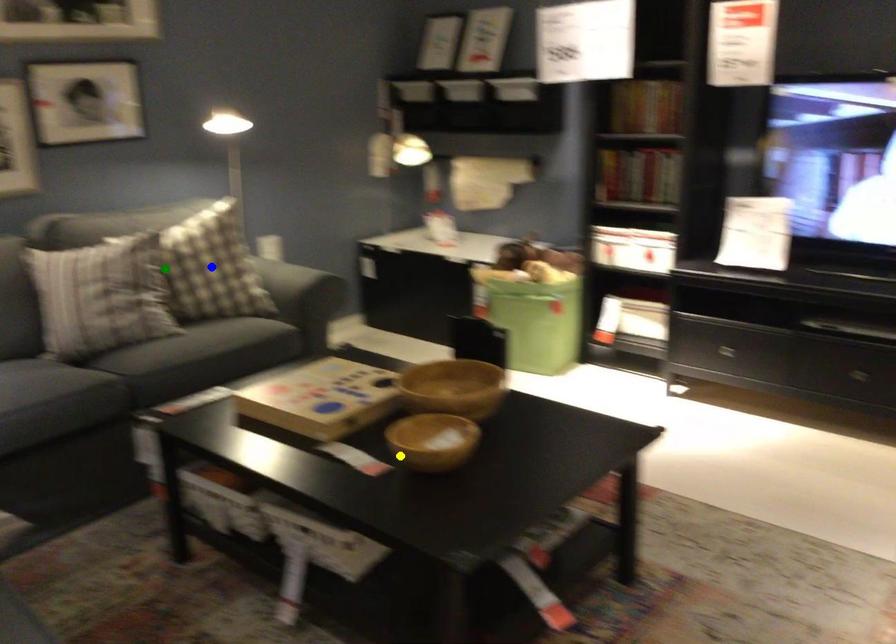
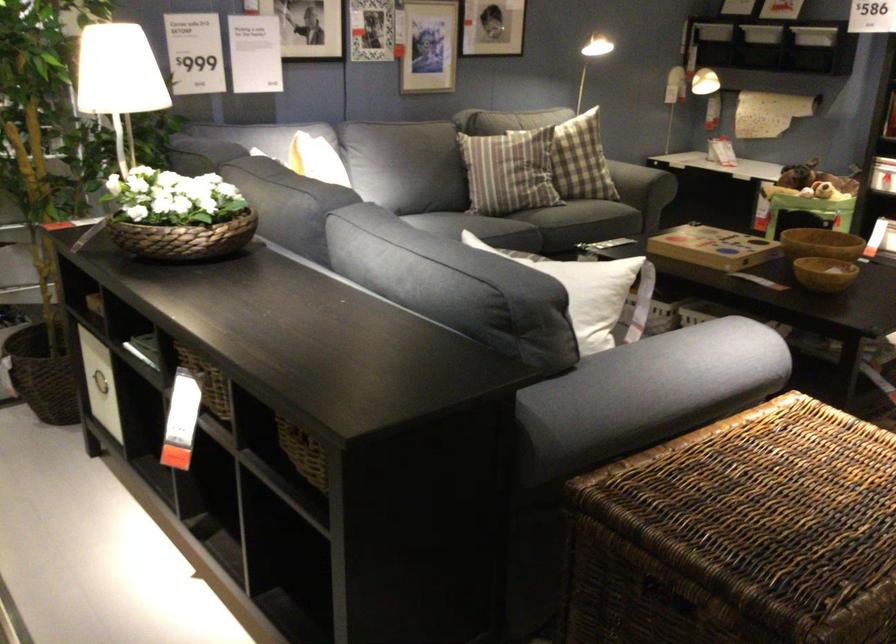
I am providing you with two images of the same scene from different viewpoints. Three points are marked in image1. Which point corresponds to a part or object that is occluded in image2?In image1, three points are marked. Which of them correspond to a part or object that is occluded in image2?Among the three points shown in image1, which one corresponds to a part or object that is no longer visible due to occlusion in image2?

blue point cannot be seen in image2.